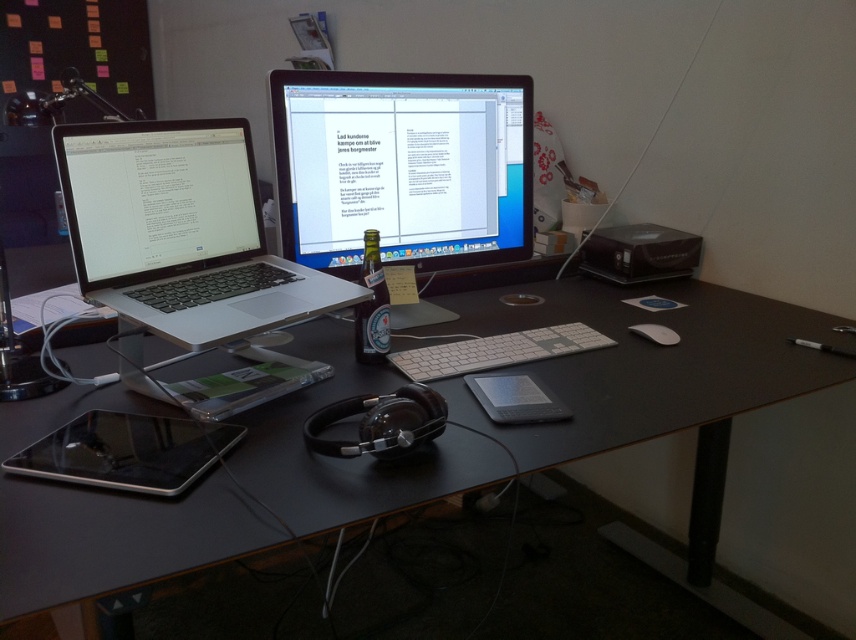
Does silver metallic laptop at left lie in front of white matte mouse at center?

Yes.

In the scene shown: Which of these two, silver metallic laptop at left or white matte mouse at center, stands shorter?

Standing shorter between the two is white matte mouse at center.

Where is `silver metallic laptop at left`? Image resolution: width=856 pixels, height=640 pixels. silver metallic laptop at left is located at coordinates (181, 230).

Locate an element on the screen. silver metallic laptop at left is located at coordinates (181, 230).

Which of these two, satin black monitor at center or white matte mouse at center, stands shorter?

Standing shorter between the two is white matte mouse at center.

Is satin black monitor at center thinner than white matte mouse at center?

No.

Does point (346, 115) come closer to viewer compared to point (672, 344)?

Yes.

Find the location of a particular element. satin black monitor at center is located at coordinates pyautogui.click(x=402, y=168).

Does point (462, 432) lie in front of point (598, 348)?

Yes, it is.

Is black plastic computer desk at center above white aluminum keyboard at center?

No.

Find the location of `black plastic computer desk at center`. black plastic computer desk at center is located at coordinates (654, 376).